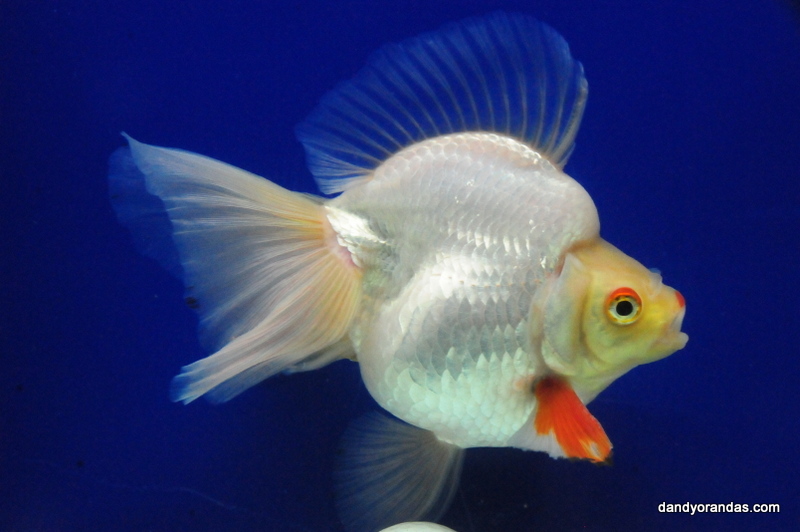
Identify the location of scales. (468, 323).